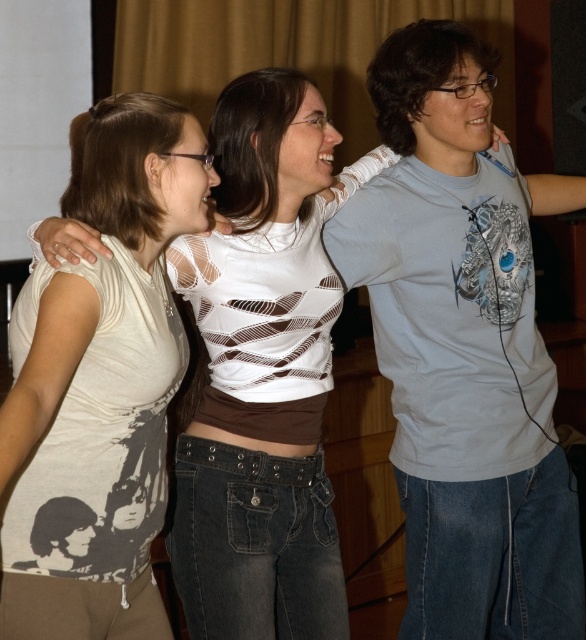
You are a photographer trying to capture the light gray cotton t shirt at center in the image. The camera you are using has a limited focus range. Can you determine if the point at coordinates (464, 348) is the correct location to focus on to ensure the light gray cotton t shirt at center is in focus?

Yes, the point at coordinates (464, 348) indicates the light gray cotton t shirt at center, so focusing there will ensure it is in focus.

You are taking a photo of two points in the scene described. The first point is at coordinate point(57, 291) and the second is at point(203, 413). Which point will appear larger in your photo?

Point(57, 291) is closer to the camera than point(203, 413), so it will appear larger in the photo.